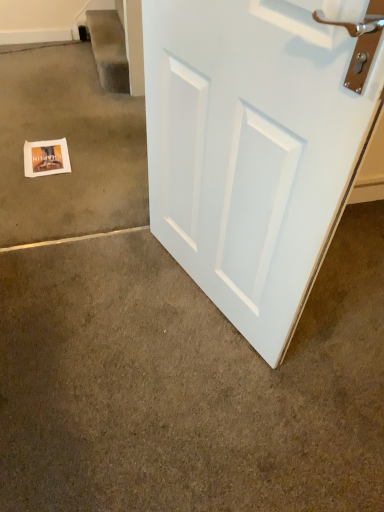
You are a GUI agent. You are given a task and a screenshot of the screen. Output one action in this format:
    pyautogui.click(x=<x>, y=<y>)
    Task: Click on the blank area to the left of white matte door at right
    The width and height of the screenshot is (384, 512).
    Given the screenshot: What is the action you would take?
    pyautogui.click(x=101, y=296)